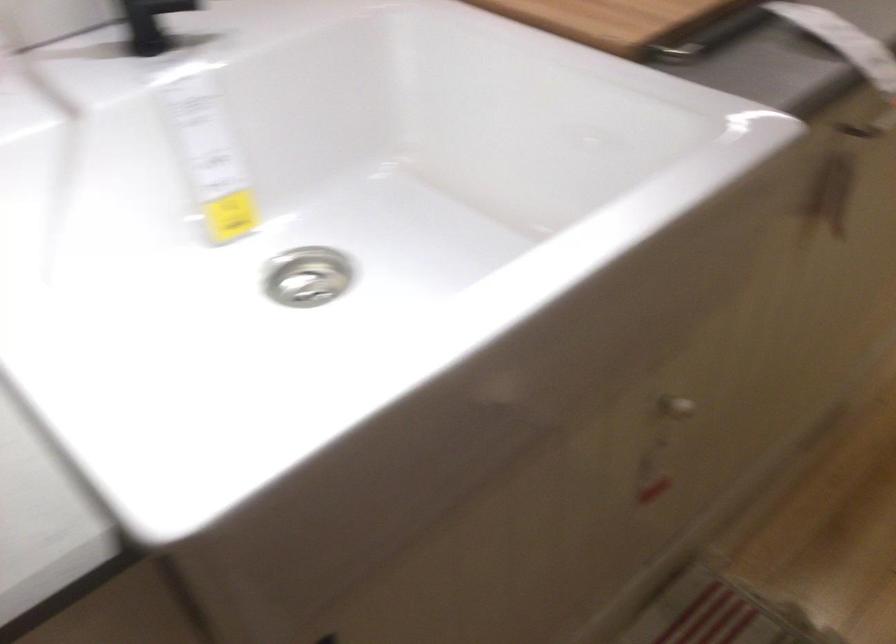
Question: The images are taken continuously from a first-person perspective. In which direction is your viewpoint rotating?

Choices:
 (A) Left
 (B) Right
 (C) Up
 (D) Down

Answer: (A)